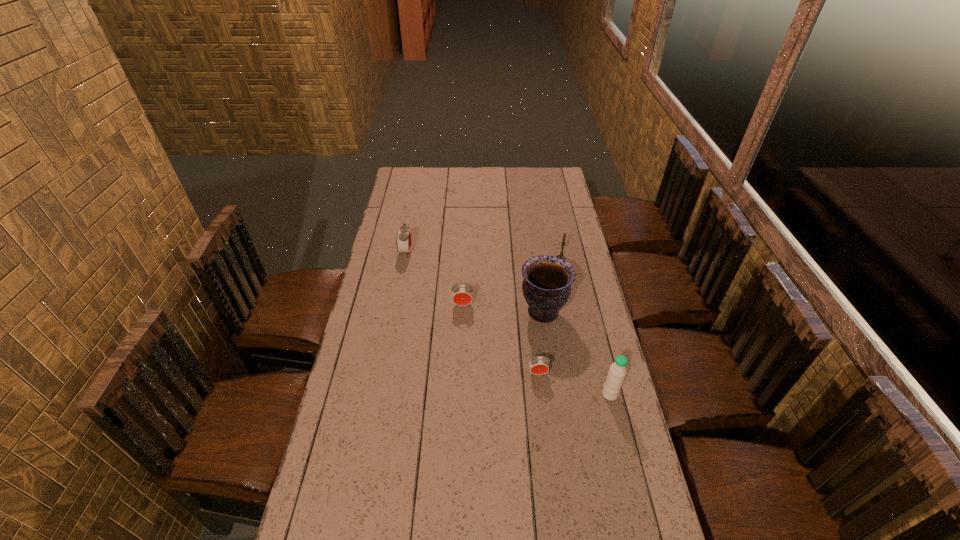
Where is `pottery located in the right edge section of the desktop`? The height and width of the screenshot is (540, 960). pottery located in the right edge section of the desktop is located at coordinates (546, 287).

Where is `water bottle that is at the right edge`? This screenshot has width=960, height=540. water bottle that is at the right edge is located at coordinates (615, 378).

Locate an element on the screen. Image resolution: width=960 pixels, height=540 pixels. vacant space at the far edge of the desktop is located at coordinates (510, 167).

Where is `vacant space at the near edge of the desktop`? vacant space at the near edge of the desktop is located at coordinates (464, 516).

I want to click on free point at the left edge, so click(366, 320).

In the image, there is a desktop. Where is `vacant space at the right edge`? vacant space at the right edge is located at coordinates (563, 218).

The image size is (960, 540). Identify the location of vacant position at the far right corner of the desktop. (559, 173).

Where is `vacant area at the near right corner of the desktop`? The width and height of the screenshot is (960, 540). vacant area at the near right corner of the desktop is located at coordinates (649, 534).

The image size is (960, 540). Find the location of `free point between the second nearest alarm clock and the water bottle`. free point between the second nearest alarm clock and the water bottle is located at coordinates (537, 349).

This screenshot has height=540, width=960. Find the location of `empty space that is in between the nearest alarm clock and the leftmost object`. empty space that is in between the nearest alarm clock and the leftmost object is located at coordinates pyautogui.click(x=471, y=313).